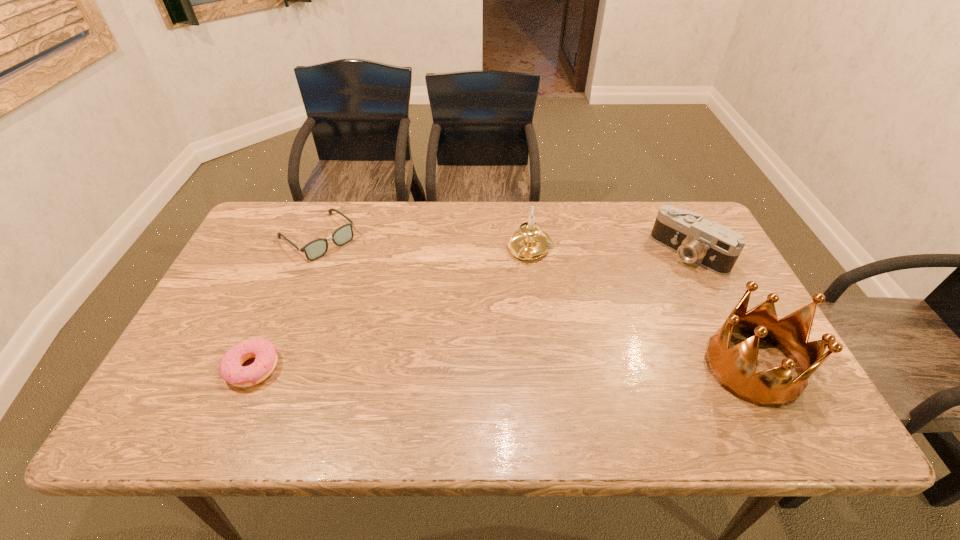
The height and width of the screenshot is (540, 960). I want to click on free space that is in between the candle holder and the third tallest object, so click(x=609, y=251).

You are a GUI agent. You are given a task and a screenshot of the screen. Output one action in this format:
    pyautogui.click(x=<x>, y=<y>)
    Task: Click on the empty location between the shortest object and the third tallest object
    This screenshot has height=540, width=960.
    Given the screenshot: What is the action you would take?
    pyautogui.click(x=471, y=310)

Image resolution: width=960 pixels, height=540 pixels. In order to click on vacant space that is in between the fourth shortest object and the fourth tallest object in this screenshot , I will do pos(423,243).

Find the location of a particular element. The image size is (960, 540). vacant space that is in between the doughnut and the camera is located at coordinates (471, 310).

Identify the location of object that is the fourth closest to the spectacles. This screenshot has height=540, width=960. (734, 368).

Locate which object ranks second in proximity to the tallest object. Please provide its 2D coordinates. Your answer should be formatted as a tuple, i.e. [(x, y)], where the tuple contains the x and y coordinates of a point satisfying the conditions above.

[(530, 242)]

Image resolution: width=960 pixels, height=540 pixels. I want to click on vacant region that satisfies the following two spatial constraints: 1. on the front side of the fourth tallest object; 2. on the right side of the camera, so click(x=312, y=253).

Image resolution: width=960 pixels, height=540 pixels. Find the location of `vacant space that satisfies the following two spatial constraints: 1. on the back side of the third tallest object; 2. on the left side of the shortest object`. vacant space that satisfies the following two spatial constraints: 1. on the back side of the third tallest object; 2. on the left side of the shortest object is located at coordinates (302, 253).

Locate an element on the screen. free space that satisfies the following two spatial constraints: 1. on the front side of the tallest object; 2. on the right side of the third object from right to left is located at coordinates (543, 367).